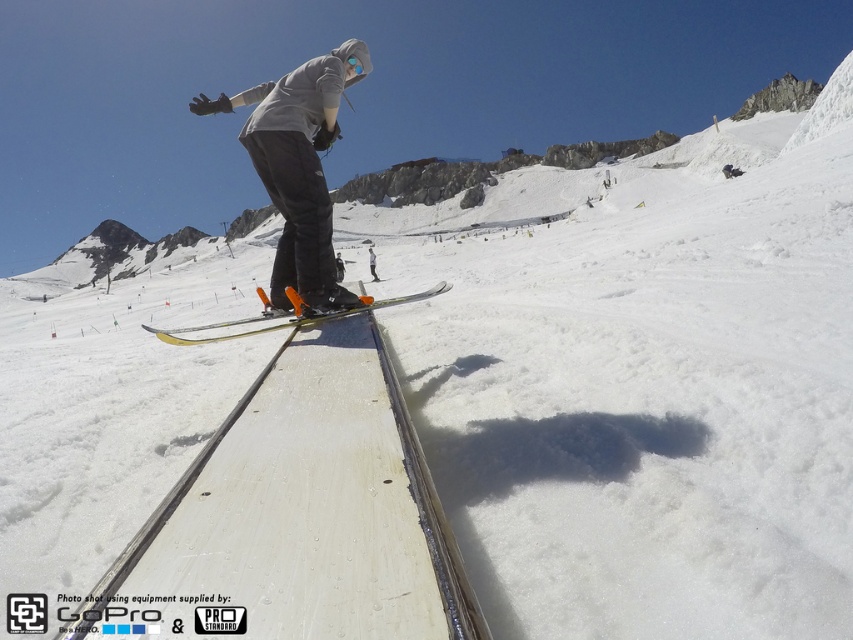
You are a photographer trying to capture the perfect shot of the gray matte hoodie at center. Based on the coordinates provided, where should you position your camera to ensure the hoodie is centered in your frame?

The gray matte hoodie at center is located at coordinates 0.263 on the x axis and 0.351 on the y axis. To center it in your frame, position your camera so the crosshairs align with these coordinates.

You are a photographer trying to capture the skier in midair. You notice the gray matte hoodie at center and the yellow metallic skis at center. Which object appears narrower in the photo?

The gray matte hoodie at center has a lesser width compared to the yellow metallic skis at center, so it appears narrower in the photo.